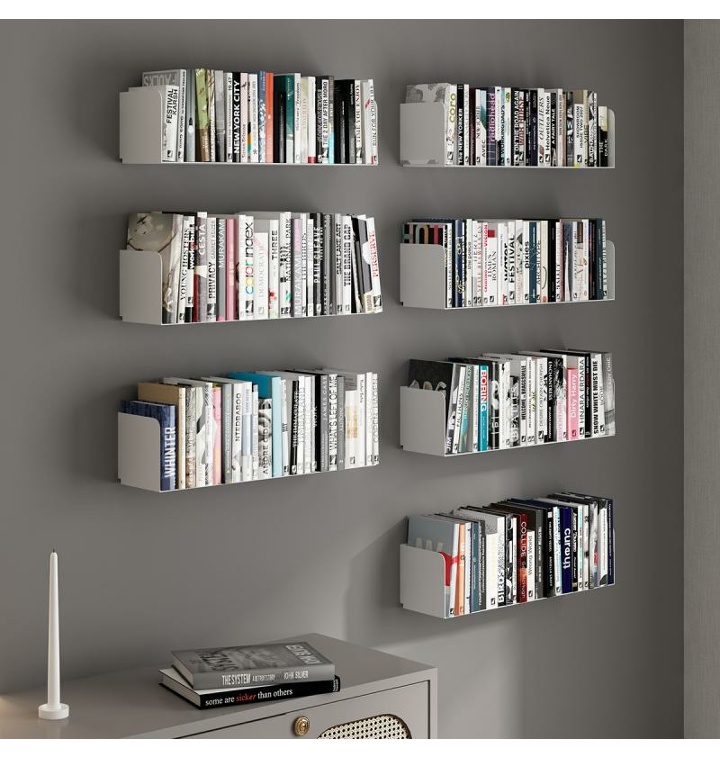
You are a GUI agent. You are given a task and a screenshot of the screen. Output one action in this format:
    pyautogui.click(x=<x>, y=<y>)
    Task: Click on the book shelves
    The image size is (720, 758).
    Given the screenshot: What is the action you would take?
    pyautogui.click(x=425, y=578), pyautogui.click(x=426, y=426), pyautogui.click(x=428, y=264), pyautogui.click(x=417, y=129), pyautogui.click(x=150, y=127), pyautogui.click(x=139, y=308), pyautogui.click(x=148, y=459)